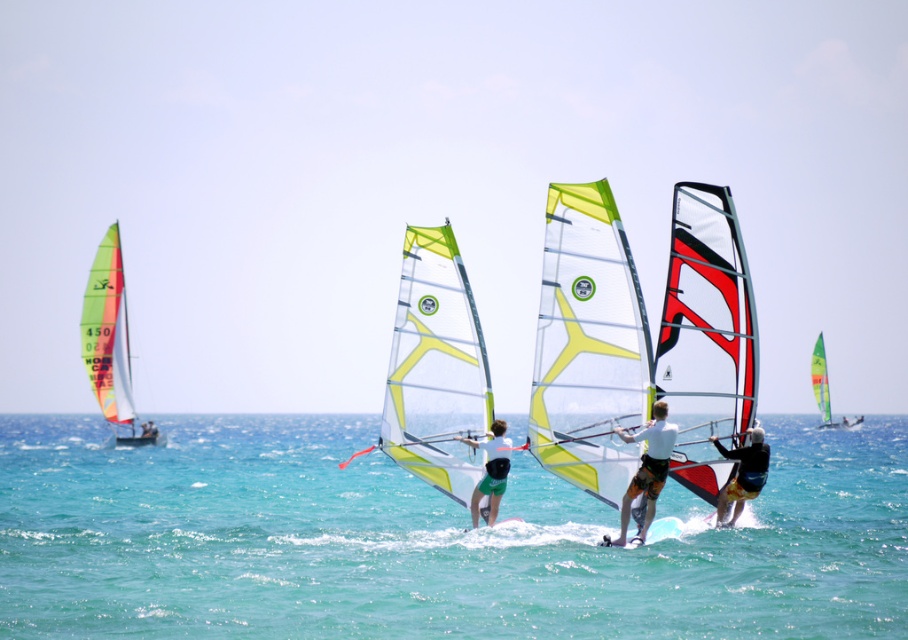
Question: Which point is closer to the camera?

Choices:
 (A) white matte windsurfing board at center
 (B) green translucent sail at left

Answer: (A)

Question: Is yellow-green translucent sail at center positioned before black matte windsurfer at center?

Choices:
 (A) no
 (B) yes

Answer: (A)

Question: Which point is closer to the camera?

Choices:
 (A) (114, 246)
 (B) (456, 385)
 (C) (676, 308)

Answer: (C)

Question: Is the position of yellow-green translucent sail at center less distant than that of green translucent sail at right?

Choices:
 (A) no
 (B) yes

Answer: (B)

Question: Which object appears closest to the camera in this image?

Choices:
 (A) black matte windsurfer at center
 (B) yellow-green translucent sail at center
 (C) green translucent sail at left

Answer: (A)

Question: Is green translucent sail at left to the right of green translucent sail at right from the viewer's perspective?

Choices:
 (A) no
 (B) yes

Answer: (A)